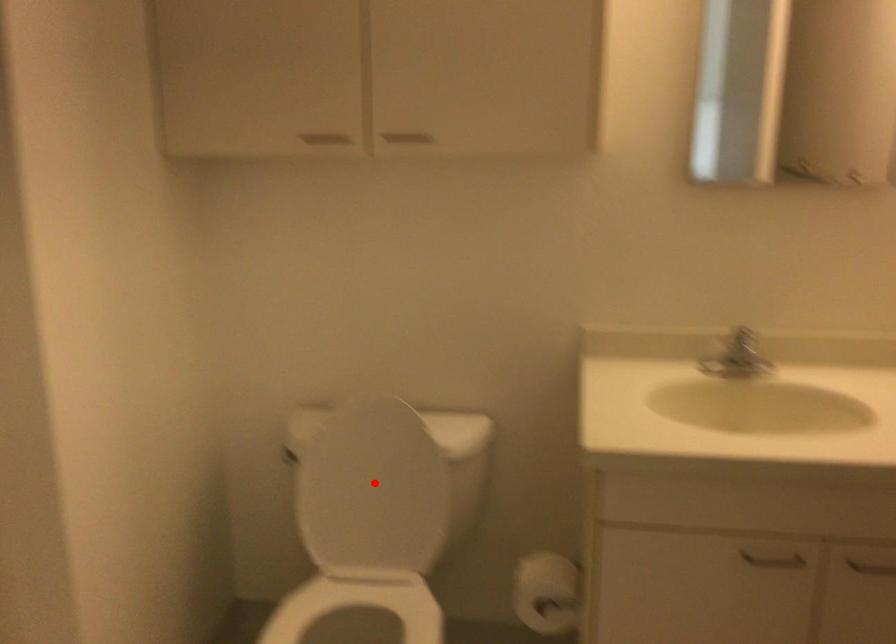
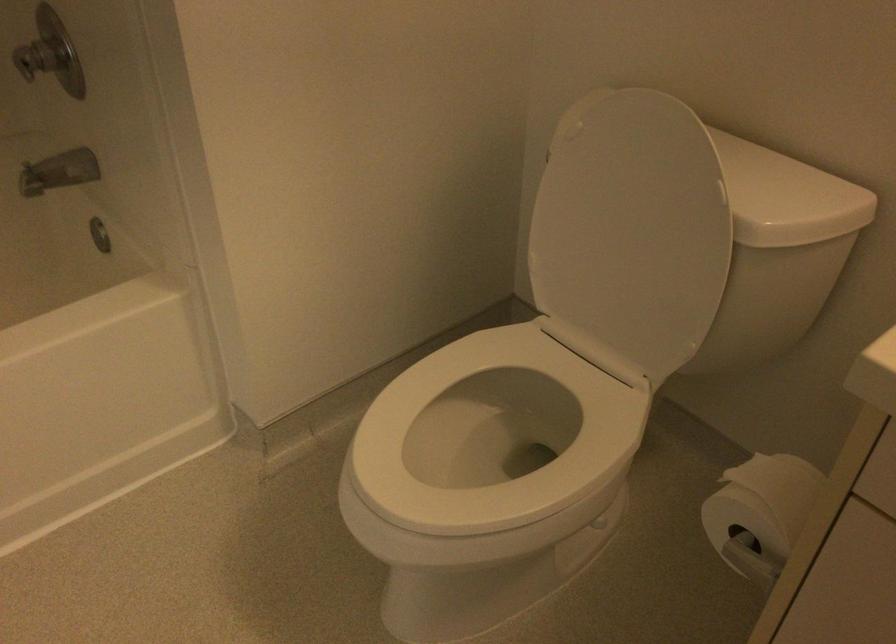
Where in the second image is the point corresponding to the highlighted location from the first image?

(631, 232)